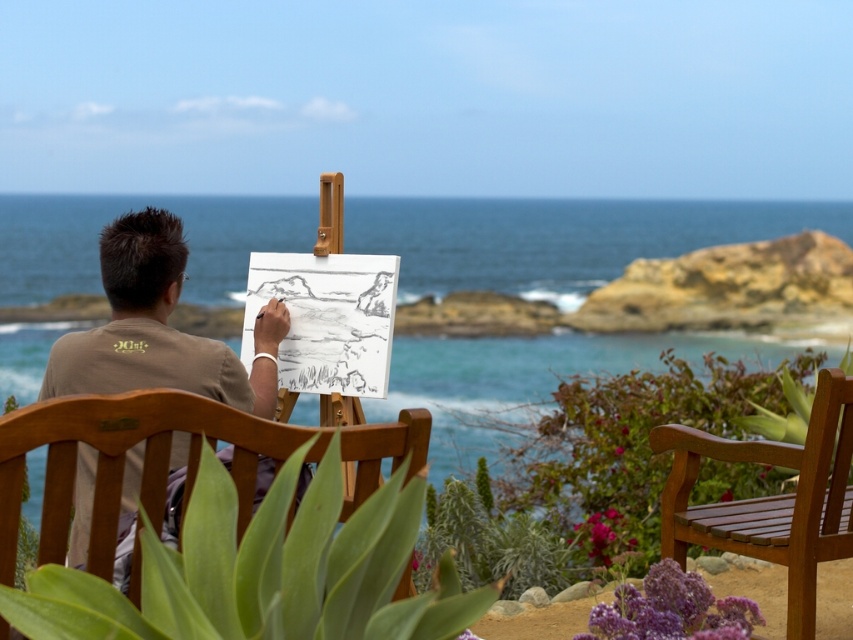
Does brown cotton shirt at center have a lesser height compared to teak wood bench at lower right?

In fact, brown cotton shirt at center may be taller than teak wood bench at lower right.

Does point (144, 336) come farther from viewer compared to point (672, 490)?

That is False.

The width and height of the screenshot is (853, 640). What do you see at coordinates (160, 328) in the screenshot?
I see `brown cotton shirt at center` at bounding box center [160, 328].

You are a GUI agent. You are given a task and a screenshot of the screen. Output one action in this format:
    pyautogui.click(x=<x>, y=<y>)
    Task: Click on the brown cotton shirt at center
    
    Given the screenshot: What is the action you would take?
    pyautogui.click(x=160, y=328)

Is blue water at center closer to camera compared to teak wood bench at lower right?

Yes, it is.

Who is more forward, (512, 376) or (815, 593)?

Point (815, 593) is more forward.

Does point (15, 202) come in front of point (817, 410)?

No, it is behind (817, 410).

Find the location of a particular element. blue water at center is located at coordinates (558, 237).

Can you confirm if blue water at center is positioned above brown cotton shirt at center?

Yes.

Does blue water at center have a greater height compared to brown cotton shirt at center?

Indeed, blue water at center has a greater height compared to brown cotton shirt at center.

Where is `blue water at center`? The image size is (853, 640). blue water at center is located at coordinates (558, 237).